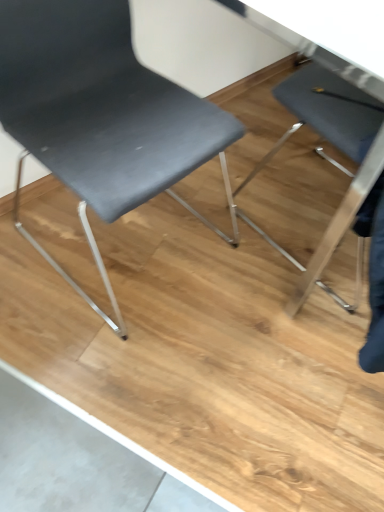
This screenshot has width=384, height=512. I want to click on vacant space that is in between matte black chair at right, which appears as the second chair when viewed from the left, and matte black chair at left, marked as the first chair in a left-to-right arrangement, so click(231, 238).